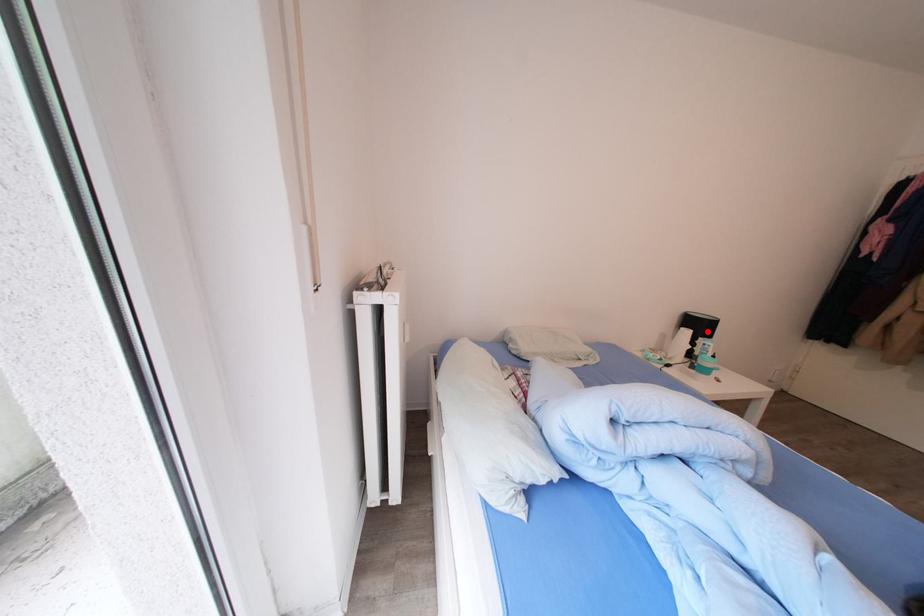
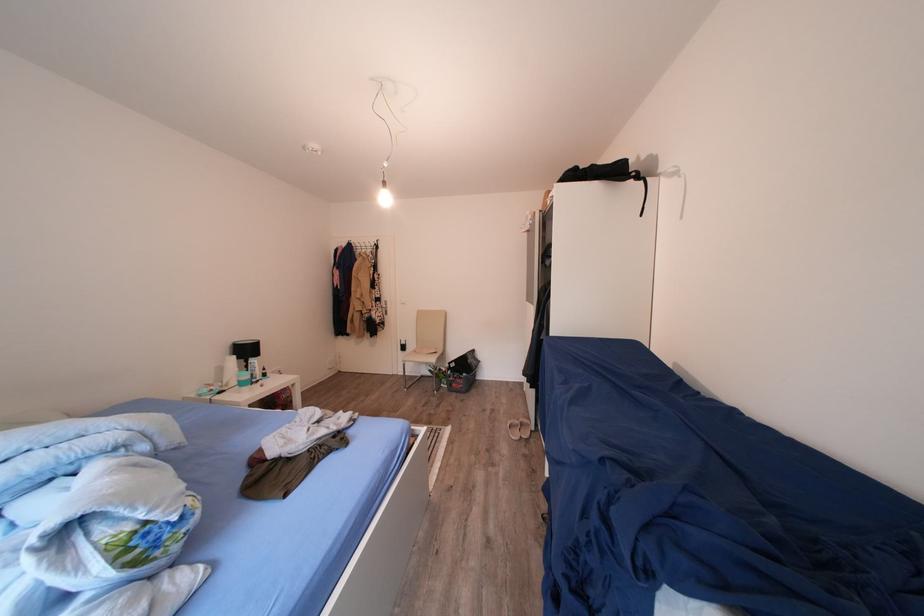
Locate, in the second image, the point that corresponds to the highlighted location in the first image.

(256, 355)